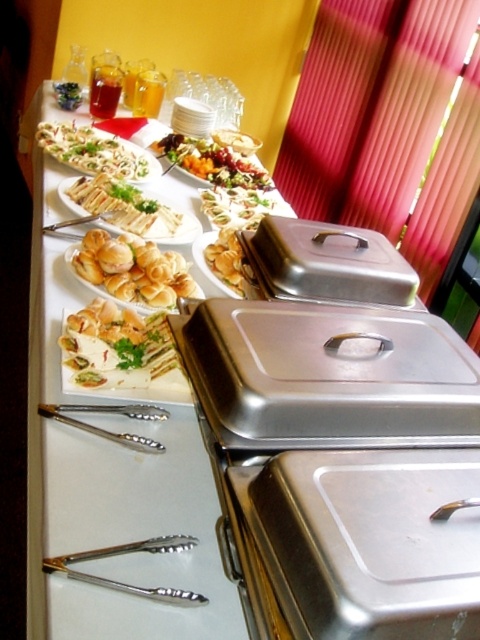
Question: Is translucent glass juice at upper left to the right of green leafy vegetable at upper left from the viewer's perspective?

Choices:
 (A) no
 (B) yes

Answer: (B)

Question: Estimate the real-world distances between objects in this image. Which object is closer to the white creamy cheese at center?

Choices:
 (A) green leafy salad at center
 (B) shiny silver platter at center
 (C) golden brown bread rolls at center
 (D) golden brown bread at center

Answer: (C)

Question: Can you confirm if matte brown bread at center is positioned above green leafy salad at center?

Choices:
 (A) no
 (B) yes

Answer: (B)

Question: Which of the following is the farthest from the observer?

Choices:
 (A) matte white bread at center
 (B) matte brown bread at center

Answer: (B)

Question: Which point is farther from the camera taking this photo?

Choices:
 (A) (240, 218)
 (B) (127, 362)
 (C) (96, 140)
 (D) (90, 244)

Answer: (C)

Question: Can you confirm if white creamy cheese at center is positioned to the left of translucent glass juice at upper left?

Choices:
 (A) no
 (B) yes

Answer: (A)